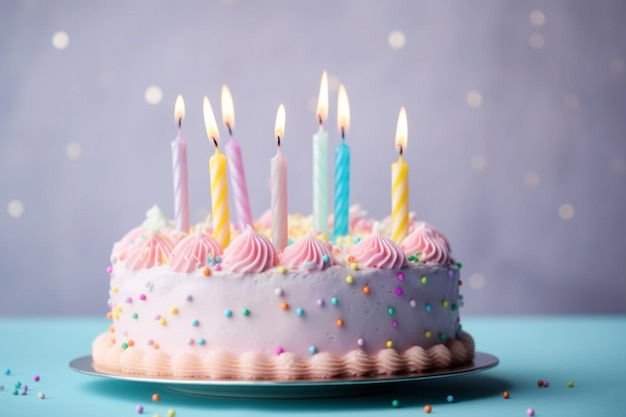
Where is `candle flames`? candle flames is located at coordinates (180, 114), (211, 119), (228, 110), (282, 123), (319, 105), (340, 115), (403, 135).